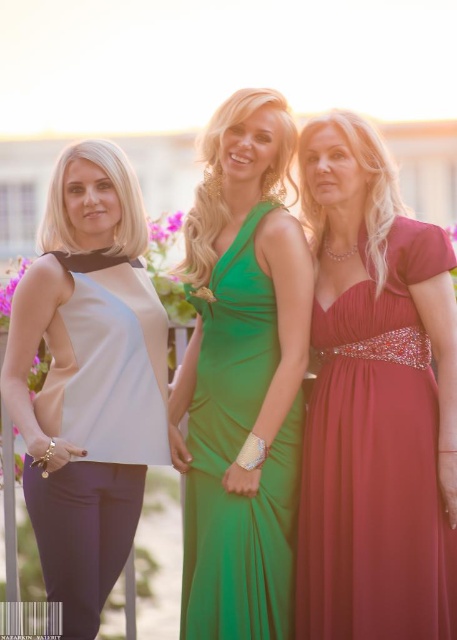
Who is more forward, (419,545) or (127,308)?

Positioned in front is point (419,545).

Who is positioned more to the right, shiny burgundy dress at right or matte white blouse at left?

shiny burgundy dress at right is more to the right.

Between point (327, 596) and point (53, 476), which one is positioned behind?

The point (53, 476) is more distant.

Image resolution: width=457 pixels, height=640 pixels. I want to click on shiny burgundy dress at right, so click(376, 460).

Is shiny burgundy dress at right smaller than green satin dress at center?

Incorrect, shiny burgundy dress at right is not smaller in size than green satin dress at center.

Does shiny burgundy dress at right appear on the right side of green satin dress at center?

Indeed, shiny burgundy dress at right is positioned on the right side of green satin dress at center.

Who is more forward, (377, 412) or (262, 572)?

Positioned in front is point (262, 572).

At what (x,y) coordinates should I click in order to perform the action: click on shiny burgundy dress at right. Please return your answer as a coordinate pair (x, y). Image resolution: width=457 pixels, height=640 pixels. Looking at the image, I should click on (376, 460).

Identify the location of matte white blouse at left. pos(97,429).

Does point (59, 512) come in front of point (228, 573)?

No, it is behind (228, 573).

The height and width of the screenshot is (640, 457). I want to click on matte white blouse at left, so click(97, 429).